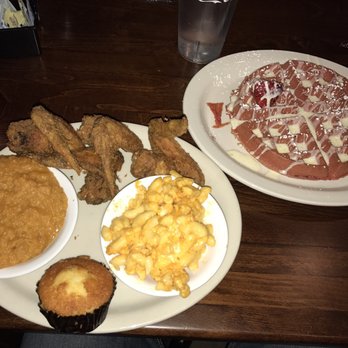
You are a GUI agent. You are given a task and a screenshot of the screen. Output one action in this format:
    pyautogui.click(x=<x>, y=<y>)
    Task: Click on the plate
    The height and width of the screenshot is (348, 348).
    Given the screenshot: What is the action you would take?
    tap(225, 192), tap(199, 96)